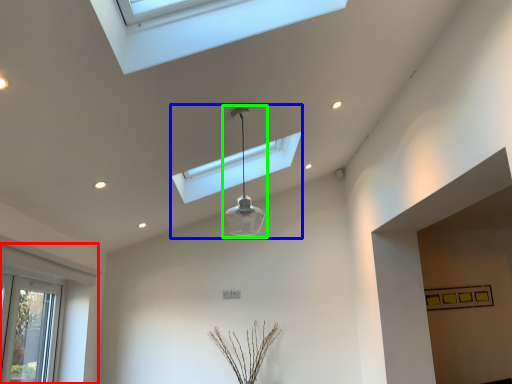
Question: Based on their relative distances, which object is nearer to window (highlighted by a red box)? Choose from lamp (highlighted by a blue box) and lamp (highlighted by a green box).

Choices:
 (A) lamp
 (B) lamp

Answer: (A)